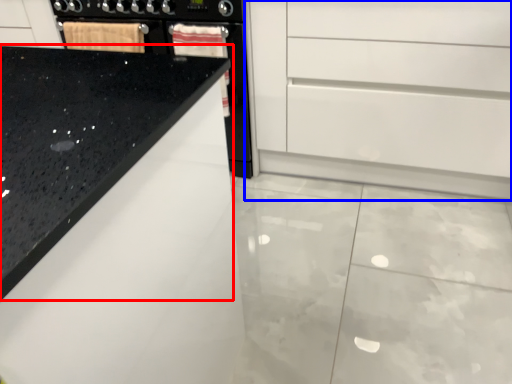
Question: Which object appears farthest to the camera in this image, countertop (highlighted by a red box) or chest of drawers (highlighted by a blue box)?

Choices:
 (A) countertop
 (B) chest of drawers

Answer: (B)